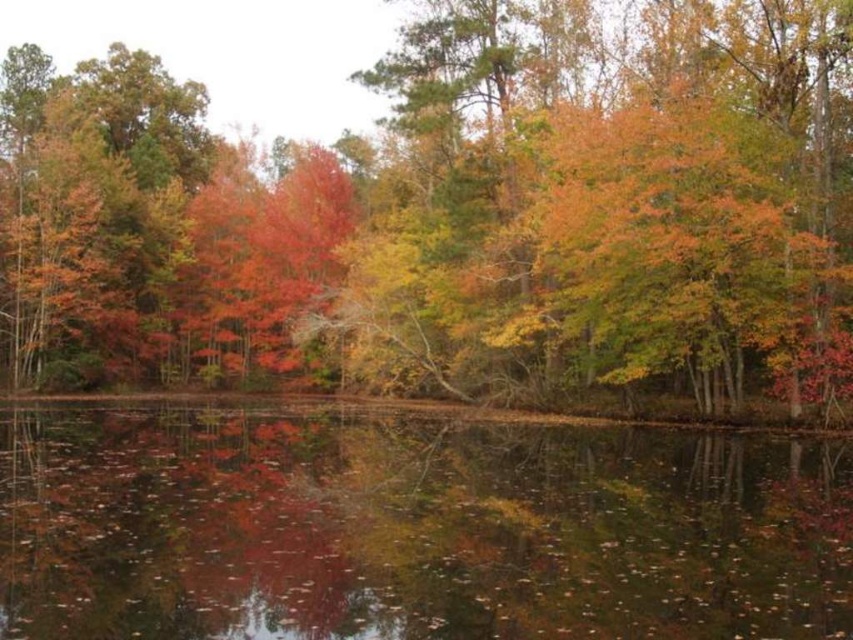
Based on the photo, which of these two, autumn leaves at center or reflective dark water at center, stands taller?

autumn leaves at center is taller.

Identify the location of autumn leaves at center. (457, 214).